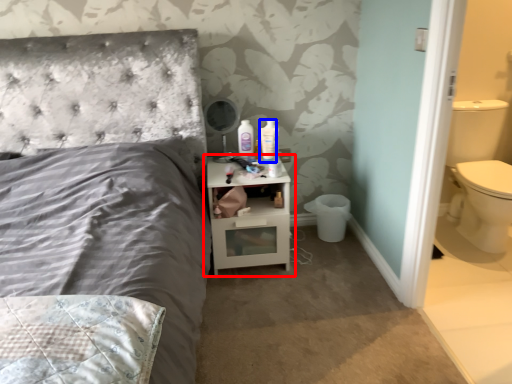
Question: Which of the following is the farthest to the observer, nightstand (highlighted by a red box) or mouthwash (highlighted by a blue box)?

Choices:
 (A) nightstand
 (B) mouthwash

Answer: (B)